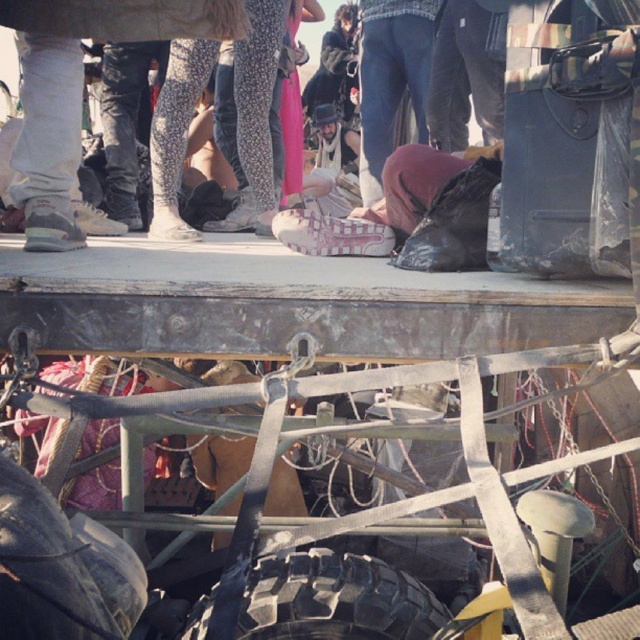
You are standing on the wooden platform and want to move the black rubber tire at lower left to the position of the black rubber tire at bottom. Is the tire you want to move currently in front of or behind the target position?

The black rubber tire at lower left is in front of the black rubber tire at bottom, so the tire you want to move is currently in front of the target position.